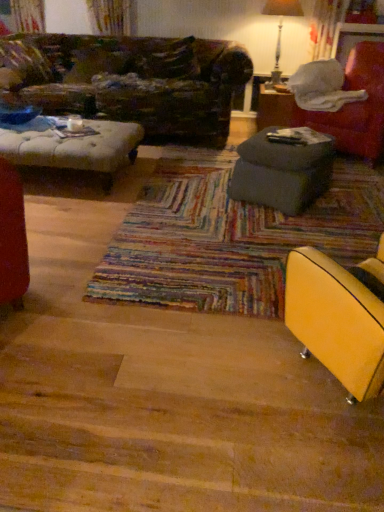
Question: From their relative heights in the image, would you say metallic silver table lamp at upper right is taller or shorter than gray fabric ottoman at right, positioned as the first table in bottom-to-top order?

Choices:
 (A) tall
 (B) short

Answer: (A)

Question: In terms of width, does metallic silver table lamp at upper right look wider or thinner when compared to gray fabric ottoman at right, which is the second table in back-to-front order?

Choices:
 (A) wide
 (B) thin

Answer: (B)

Question: Which object is positioned farthest from the gray fabric ottoman at right, which is the second table in back-to-front order?

Choices:
 (A) yellow leather chair at lower right, the 2th chair from the top
 (B) velvet red armchair at right, which is the 2th chair in bottom-to-top order
 (C) metallic silver table lamp at upper right
 (D) matte gray ottoman at center, which ranks as the second table in front-to-back order

Answer: (C)

Question: Estimate the real-world distances between objects in this image. Which object is closer to the velvet red armchair at right, which ranks as the second chair in left-to-right order?

Choices:
 (A) yellow leather chair at lower right, the 2th chair from the top
 (B) metallic silver table lamp at upper right
 (C) matte gray ottoman at center, which ranks as the first table in back-to-front order
 (D) gray fabric ottoman at right, positioned as the second table in top-to-bottom order

Answer: (C)